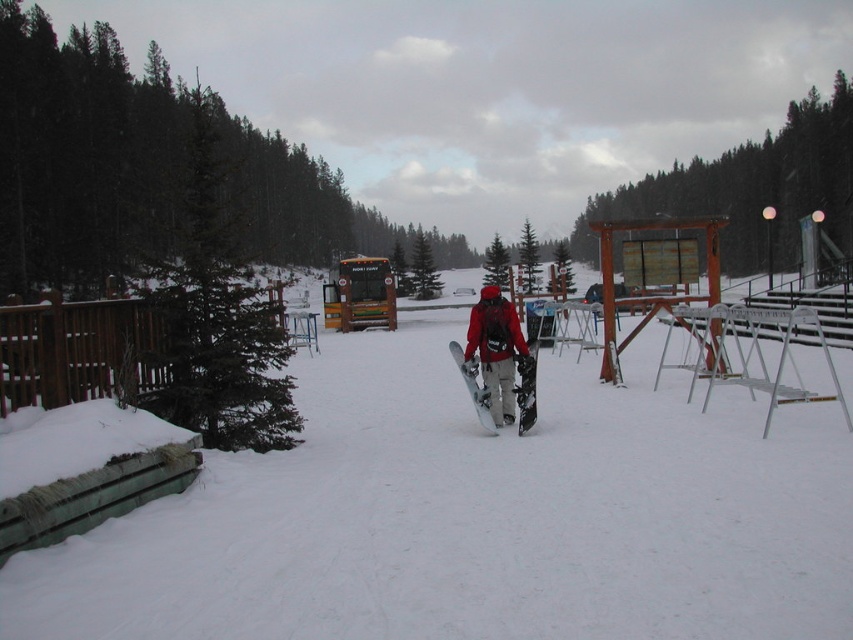
Is white matte snow at center further to the viewer compared to yellow-green painted school bus at center?

No, white matte snow at center is in front of yellow-green painted school bus at center.

Is point (219, 502) positioned in front of point (357, 291)?

Yes, it is.

Is point (480, 484) positioned behind point (358, 291)?

No, (480, 484) is closer to viewer.

The image size is (853, 640). I want to click on white matte snow at center, so click(x=476, y=516).

Which of these two, black matte snowboard at center or white matte snowboard at center, stands taller?

black matte snowboard at center

Where is `black matte snowboard at center`? This screenshot has width=853, height=640. black matte snowboard at center is located at coordinates (527, 371).

This screenshot has height=640, width=853. What are the coordinates of `yellow-green painted school bus at center` in the screenshot? It's located at (358, 294).

Is the position of yellow-green painted school bus at center less distant than that of black matte snowboard at center?

No, it is behind black matte snowboard at center.

Is point (341, 262) closer to viewer compared to point (537, 323)?

No.

Find the location of a particular element. The height and width of the screenshot is (640, 853). yellow-green painted school bus at center is located at coordinates (358, 294).